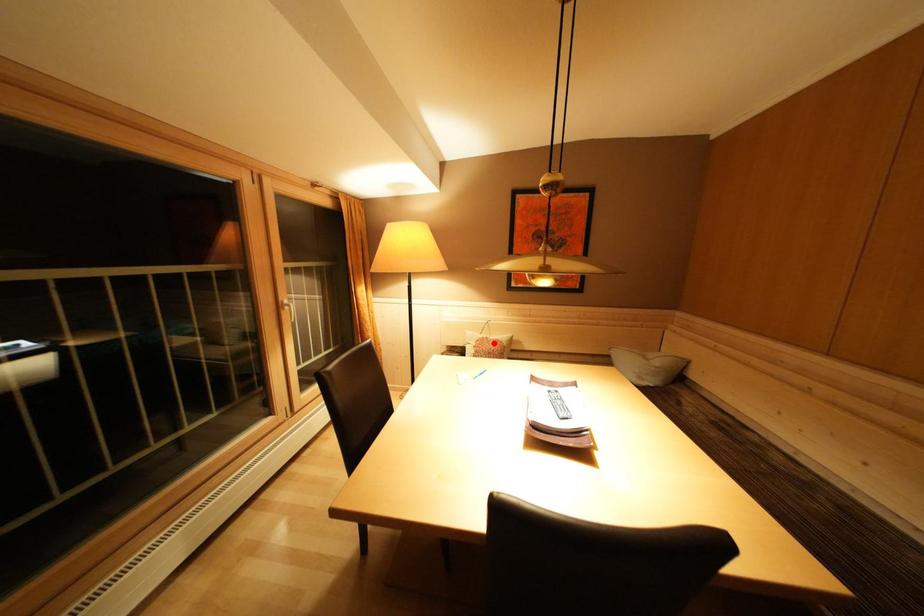
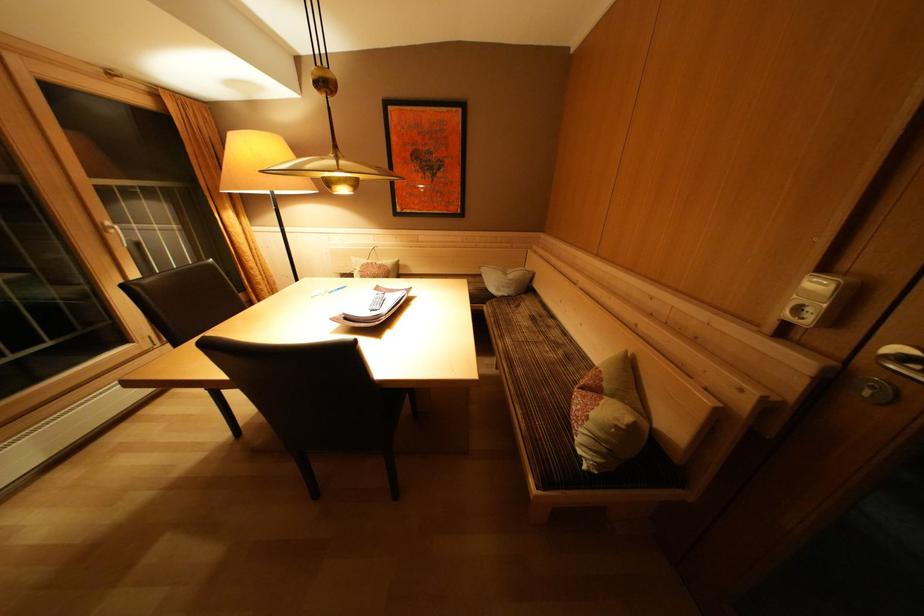
Locate, in the second image, the point that corresponds to the highlighted location in the first image.

(379, 268)